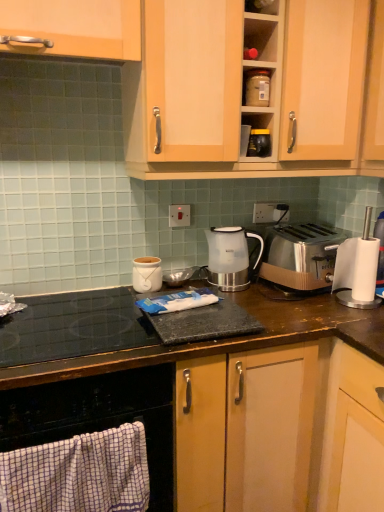
Question: Does wooden cabinet handle at upper left, acting as the 1th cabinetry starting from the left, have a smaller size compared to satin silver outlet at center, placed as the second electric outlet when sorted from left to right?

Choices:
 (A) no
 (B) yes

Answer: (A)

Question: Does wooden cabinet handle at upper left, acting as the 2th cabinetry starting from the right, have a larger size compared to satin silver outlet at center, acting as the 1th electric outlet starting from the back?

Choices:
 (A) no
 (B) yes

Answer: (B)

Question: Is wooden cabinet handle at upper left, acting as the 1th cabinetry starting from the left, wider than satin silver outlet at center, placed as the second electric outlet when sorted from left to right?

Choices:
 (A) yes
 (B) no

Answer: (A)

Question: Can you confirm if wooden cabinet handle at upper left, acting as the 2th cabinetry starting from the right, is positioned to the left of satin silver outlet at center, the 2th electric outlet in the front-to-back sequence?

Choices:
 (A) no
 (B) yes

Answer: (B)

Question: From the image's perspective, is wooden cabinet handle at upper left, acting as the 1th cabinetry starting from the left, on top of satin silver outlet at center, acting as the 1th electric outlet starting from the back?

Choices:
 (A) yes
 (B) no

Answer: (A)

Question: From a real-world perspective, is white glossy electric kettle at center, the 2th kitchen appliance positioned from the left, positioned above or below wooden cabinet at upper center, which ranks as the 1th cabinetry in right-to-left order?

Choices:
 (A) below
 (B) above

Answer: (A)

Question: Choose the correct answer: Is white glossy electric kettle at center, the 2th kitchen appliance positioned from the left, inside wooden cabinet at upper center, which ranks as the 2th cabinetry in left-to-right order, or outside it?

Choices:
 (A) inside
 (B) outside

Answer: (B)

Question: In terms of height, does white glossy electric kettle at center, positioned as the 2th kitchen appliance in top-to-bottom order, look taller or shorter compared to wooden cabinet at upper center, which ranks as the 1th cabinetry in right-to-left order?

Choices:
 (A) tall
 (B) short

Answer: (B)

Question: Visually, is white glossy electric kettle at center, the second kitchen appliance positioned from the right, positioned to the left or to the right of wooden cabinet at upper center, which ranks as the 2th cabinetry in left-to-right order?

Choices:
 (A) left
 (B) right

Answer: (A)

Question: Is point (43, 333) closer or farther from the camera than point (178, 218)?

Choices:
 (A) farther
 (B) closer

Answer: (B)

Question: In terms of width, does black glass cooktop at lower left look wider or thinner when compared to white plastic electric outlet at center, which is the 1th electric outlet in left-to-right order?

Choices:
 (A) thin
 (B) wide

Answer: (B)

Question: Considering the relative positions of black glass cooktop at lower left and white plastic electric outlet at center, the second electric outlet viewed from the right, in the image provided, is black glass cooktop at lower left to the left or to the right of white plastic electric outlet at center, the second electric outlet viewed from the right,?

Choices:
 (A) right
 (B) left

Answer: (B)

Question: From their relative heights in the image, would you say black glass cooktop at lower left is taller or shorter than white plastic electric outlet at center, which is the 1th electric outlet in left-to-right order?

Choices:
 (A) tall
 (B) short

Answer: (B)

Question: From a real-world perspective, is black glass cooktop at lower left physically located above or below wooden cabinet at upper center, which ranks as the 2th cabinetry in left-to-right order?

Choices:
 (A) below
 (B) above

Answer: (A)

Question: In terms of size, does black glass cooktop at lower left appear bigger or smaller than wooden cabinet at upper center, which ranks as the 2th cabinetry in left-to-right order?

Choices:
 (A) big
 (B) small

Answer: (B)